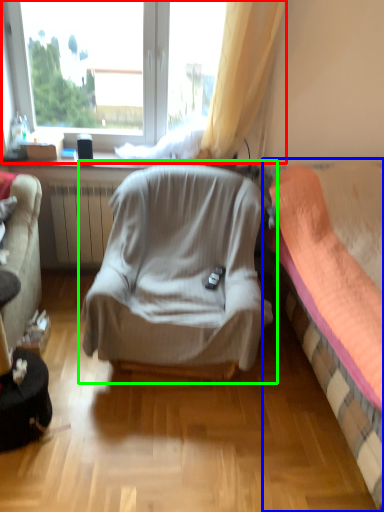
Question: Which object is the closest to the window (highlighted by a red box)? Choose among these: bed (highlighted by a blue box) or chair (highlighted by a green box).

Choices:
 (A) bed
 (B) chair

Answer: (B)